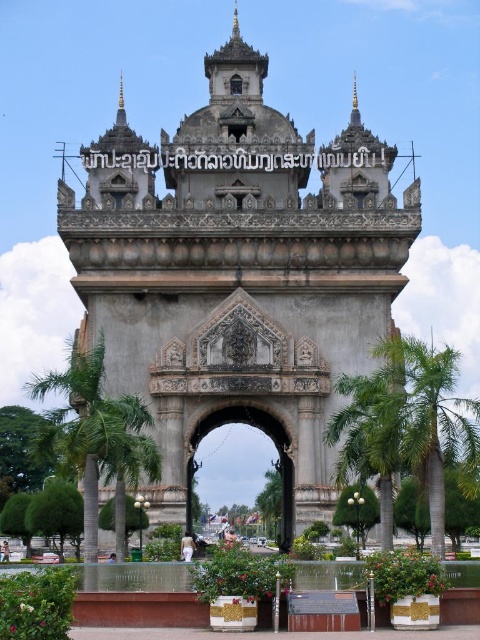
Based on the scene description, can you determine if the gray stone archway at center is wider than the green leafy palm tree at center?

The gray stone archway at center is wider than the green leafy palm tree at center according to the description.